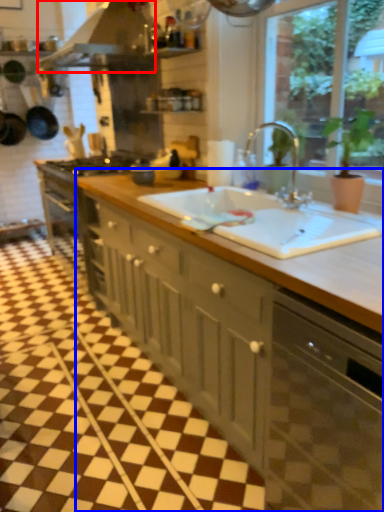
Question: Which of the following is the farthest to the observer, exhaust hood (highlighted by a red box) or cabinetry (highlighted by a blue box)?

Choices:
 (A) exhaust hood
 (B) cabinetry

Answer: (A)